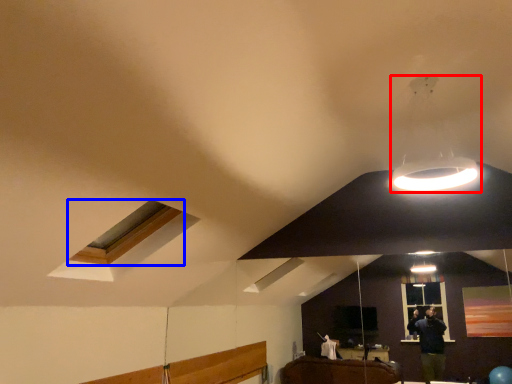
Question: Which object appears farthest to the camera in this image, lamp (highlighted by a red box) or window (highlighted by a blue box)?

Choices:
 (A) lamp
 (B) window

Answer: (B)